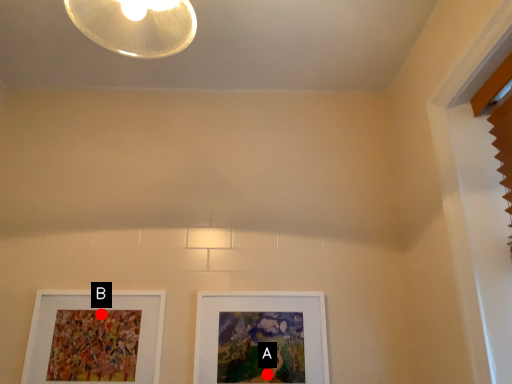
Question: Two points are circled on the image, labeled by A and B beside each circle. Which point appears closest to the camera in this image?

Choices:
 (A) A is closer
 (B) B is closer

Answer: (A)